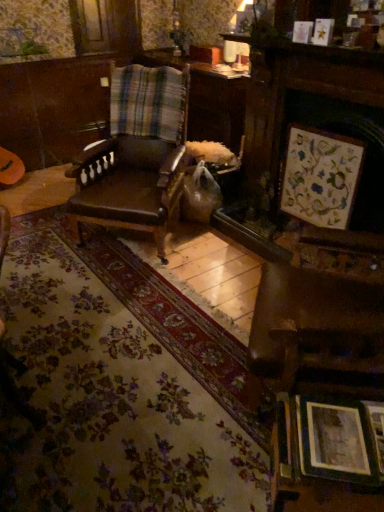
The image size is (384, 512). What do you see at coordinates (149, 102) in the screenshot?
I see `plaid fabric at center` at bounding box center [149, 102].

Locate an element on the screen. The image size is (384, 512). brown leather chair at center is located at coordinates (136, 155).

You are a GUI agent. You are given a task and a screenshot of the screen. Output one action in this format:
    pyautogui.click(x=<x>, y=<y>)
    Task: Click on the wooden picture frame at upper right, which appears as the 4th picture frame when viewed from the front
    This screenshot has height=512, width=384.
    Given the screenshot: What is the action you would take?
    pyautogui.click(x=323, y=31)

Describe the element at coordinates (377, 430) in the screenshot. I see `matte silver picture frame at lower right, which is counted as the fourth picture frame, starting from the back` at that location.

Describe the element at coordinates (320, 176) in the screenshot. I see `wooden framed artwork at upper right, which is counted as the 3th picture frame, starting from the bottom` at that location.

Identify the location of plaid fabric at center. (149, 102).

Would you say wooden picture frame at upper right, arranged as the second picture frame when viewed from the top, is inside or outside matte silver picture frame at lower right, the fourth picture frame positioned from the top?

wooden picture frame at upper right, arranged as the second picture frame when viewed from the top, is spatially situated outside matte silver picture frame at lower right, the fourth picture frame positioned from the top.

Which of these two, wooden picture frame at upper right, which appears as the 4th picture frame when viewed from the front, or matte silver picture frame at lower right, the fourth picture frame positioned from the top, stands shorter?

With less height is matte silver picture frame at lower right, the fourth picture frame positioned from the top.

Which picture frame is the 2nd one when counting from the back of the matte silver picture frame at lower right, the second picture frame when ordered from bottom to top? Please provide its 2D coordinates.

[(323, 31)]

In the image, is matte silver picture frame at lower right, which is counted as the fourth picture frame, starting from the back, positioned in front of or behind plaid fabric at center?

matte silver picture frame at lower right, which is counted as the fourth picture frame, starting from the back, is positioned closer to the viewer than plaid fabric at center.

In the scene shown: Are matte silver picture frame at lower right, the second picture frame when ordered from bottom to top, and plaid fabric at center beside each other?

They are not placed beside each other.

Based on the photo, from the image's perspective, which one is positioned higher, matte silver picture frame at lower right, the second picture frame when ordered from bottom to top, or plaid fabric at center?

plaid fabric at center.

The width and height of the screenshot is (384, 512). Identify the location of curtain behind the matte silver picture frame at lower right, which is the 2th picture frame from front to back. (149, 102).

Considering the sizes of objects wooden framed artwork at upper right, arranged as the third picture frame when viewed from the back, and wooden picture frame at upper right, which is the 4th picture frame from bottom to top, in the image provided, who is shorter, wooden framed artwork at upper right, arranged as the third picture frame when viewed from the back, or wooden picture frame at upper right, which is the 4th picture frame from bottom to top,?

wooden picture frame at upper right, which is the 4th picture frame from bottom to top, is shorter.

Is wooden framed artwork at upper right, arranged as the third picture frame when viewed from the back, spatially inside wooden picture frame at upper right, which is the 4th picture frame from bottom to top, or outside of it?

wooden framed artwork at upper right, arranged as the third picture frame when viewed from the back, is not inside wooden picture frame at upper right, which is the 4th picture frame from bottom to top, it's outside.

Are wooden framed artwork at upper right, marked as the third picture frame in a front-to-back arrangement, and wooden picture frame at upper right, placed as the 2th picture frame when sorted from back to front, beside each other?

No, wooden framed artwork at upper right, marked as the third picture frame in a front-to-back arrangement, is not next to wooden picture frame at upper right, placed as the 2th picture frame when sorted from back to front.

How many degrees apart are the facing directions of wooden framed artwork at upper right, arranged as the third picture frame when viewed from the back, and wooden picture frame at upper right, which is the 4th picture frame from bottom to top?

The angular difference between wooden framed artwork at upper right, arranged as the third picture frame when viewed from the back, and wooden picture frame at upper right, which is the 4th picture frame from bottom to top, is 2.73 degrees.

In terms of size, does wooden picture frame at upper right, placed as the 2th picture frame when sorted from back to front, appear bigger or smaller than wooden framed artwork at upper right, which is counted as the 3th picture frame, starting from the bottom?

Clearly, wooden picture frame at upper right, placed as the 2th picture frame when sorted from back to front, is smaller in size than wooden framed artwork at upper right, which is counted as the 3th picture frame, starting from the bottom.

In terms of height, does wooden picture frame at upper right, placed as the 2th picture frame when sorted from back to front, look taller or shorter compared to wooden framed artwork at upper right, marked as the third picture frame in a front-to-back arrangement?

wooden picture frame at upper right, placed as the 2th picture frame when sorted from back to front, is shorter than wooden framed artwork at upper right, marked as the third picture frame in a front-to-back arrangement.

In the scene shown: Relative to wooden framed artwork at upper right, arranged as the third picture frame when viewed from the back, is wooden picture frame at upper right, which is the 4th picture frame from bottom to top, in front or behind?

Visually, wooden picture frame at upper right, which is the 4th picture frame from bottom to top, is located behind wooden framed artwork at upper right, arranged as the third picture frame when viewed from the back.

Is plaid fabric at center placed right next to wooden framed artwork at upper right, which is counted as the 3th picture frame, starting from the bottom?

No.

From the image's perspective, which is above, plaid fabric at center or wooden framed artwork at upper right, which is counted as the 3th picture frame, starting from the bottom?

plaid fabric at center is shown above in the image.

Which object is thinner, plaid fabric at center or wooden framed artwork at upper right, arranged as the third picture frame when viewed from the back?

wooden framed artwork at upper right, arranged as the third picture frame when viewed from the back, is thinner.

Measure the distance from plaid fabric at center to wooden framed artwork at upper right, which is counted as the 3th picture frame, starting from the bottom.

plaid fabric at center is 39.35 inches from wooden framed artwork at upper right, which is counted as the 3th picture frame, starting from the bottom.

Between wooden picture frame at upper right, which appears as the 4th picture frame when viewed from the front, and plaid fabric at center, which one has smaller width?

Thinner between the two is wooden picture frame at upper right, which appears as the 4th picture frame when viewed from the front.

Would you consider wooden picture frame at upper right, which is the 4th picture frame from bottom to top, to be distant from plaid fabric at center?

Yes, wooden picture frame at upper right, which is the 4th picture frame from bottom to top, is far from plaid fabric at center.

Between wooden picture frame at upper right, which appears as the 4th picture frame when viewed from the front, and plaid fabric at center, which one is positioned behind?

plaid fabric at center is more distant.

I want to click on picture frame below the matte silver picture frame at lower right, which is counted as the fourth picture frame, starting from the back (from the image's perspective), so [x=340, y=440].

Which object is thinner, matte silver picture frame at lower right, the fourth picture frame positioned from the top, or wooden picture frame at lower right, the 5th picture frame positioned from the top?

matte silver picture frame at lower right, the fourth picture frame positioned from the top, is thinner.

Is matte silver picture frame at lower right, the second picture frame when ordered from bottom to top, positioned far away from wooden picture frame at lower right, the 5th picture frame positioned from the top?

No, matte silver picture frame at lower right, the second picture frame when ordered from bottom to top, is not far from wooden picture frame at lower right, the 5th picture frame positioned from the top.

From a real-world perspective, is matte silver picture frame at lower right, which is counted as the fourth picture frame, starting from the back, located higher than wooden picture frame at lower right, the first picture frame in the front-to-back sequence?

Incorrect, from a real-world perspective, matte silver picture frame at lower right, which is counted as the fourth picture frame, starting from the back, is lower than wooden picture frame at lower right, the first picture frame in the front-to-back sequence.

You are a GUI agent. You are given a task and a screenshot of the screen. Output one action in this format:
    pyautogui.click(x=<x>, y=<y>)
    Task: Click on the picture frame that is the 4th one below the wooden picture frame at upper right, which appears as the 4th picture frame when viewed from the front (from a real-world perspective)
    This screenshot has width=384, height=512.
    Given the screenshot: What is the action you would take?
    pyautogui.click(x=377, y=430)

Find the location of a particular element. curtain behind the matte silver picture frame at lower right, the second picture frame when ordered from bottom to top is located at coordinates (149, 102).

Considering their positions, is wooden picture frame at lower right, the 1th picture frame positioned from the bottom, positioned closer to brown leather chair at center than wooden picture frame at upper center, acting as the 5th picture frame starting from the bottom?

wooden picture frame at upper center, acting as the 5th picture frame starting from the bottom, is closer to brown leather chair at center.

When comparing their distances from wooden framed artwork at upper right, arranged as the third picture frame when viewed from the back, does matte silver picture frame at lower right, which is counted as the fourth picture frame, starting from the back, or wooden picture frame at upper center, the 1th picture frame from the back, seem closer?

wooden picture frame at upper center, the 1th picture frame from the back.

When comparing their distances from wooden picture frame at lower right, the first picture frame in the front-to-back sequence, does brown leather chair at center or plaid fabric at center seem further?

plaid fabric at center lies further to wooden picture frame at lower right, the first picture frame in the front-to-back sequence, than the other object.

When comparing their distances from wooden picture frame at upper center, acting as the 5th picture frame starting from the bottom, does plaid fabric at center or wooden picture frame at lower right, the 1th picture frame positioned from the bottom, seem closer?

plaid fabric at center is positioned closer to the anchor wooden picture frame at upper center, acting as the 5th picture frame starting from the bottom.

Based on the photo, estimate the real-world distances between objects in this image. Which object is further from wooden framed artwork at upper right, which is the 3th picture frame in top-to-bottom order, wooden picture frame at upper center, which is the first picture frame from top to bottom, or brown leather chair at center?

Based on the image, brown leather chair at center appears to be further to wooden framed artwork at upper right, which is the 3th picture frame in top-to-bottom order.

From the image, which object appears to be nearer to plaid fabric at center, wooden picture frame at upper center, which is the first picture frame from top to bottom, or matte silver picture frame at lower right, which is counted as the fourth picture frame, starting from the back?

wooden picture frame at upper center, which is the first picture frame from top to bottom, is closer to plaid fabric at center.

In the scene shown: Considering their positions, is wooden picture frame at lower right, the 1th picture frame positioned from the bottom, positioned closer to matte silver picture frame at lower right, which is the 2th picture frame from front to back, than plaid fabric at center?

wooden picture frame at lower right, the 1th picture frame positioned from the bottom, is positioned closer to the anchor matte silver picture frame at lower right, which is the 2th picture frame from front to back.

From the image, which object appears to be farther from plaid fabric at center, brown leather chair at center or wooden framed artwork at upper right, which is the 3th picture frame in top-to-bottom order?

wooden framed artwork at upper right, which is the 3th picture frame in top-to-bottom order, lies further to plaid fabric at center than the other object.

Image resolution: width=384 pixels, height=512 pixels. Identify the location of curtain between brown leather chair at center and wooden picture frame at upper right, placed as the 2th picture frame when sorted from back to front. (149, 102).

What are the coordinates of `chair that lies between wooden picture frame at upper center, acting as the 5th picture frame starting from the bottom, and matte silver picture frame at lower right, the fourth picture frame positioned from the top, from top to bottom` in the screenshot? It's located at (136, 155).

Locate an element on the screen. The image size is (384, 512). picture frame between brown leather chair at center and matte silver picture frame at lower right, the second picture frame when ordered from bottom to top, in the up-down direction is located at coordinates (320, 176).

What are the coordinates of `chair between wooden picture frame at upper center, the 1th picture frame from the back, and wooden picture frame at lower right, the first picture frame in the front-to-back sequence, in the vertical direction` in the screenshot? It's located at (136, 155).